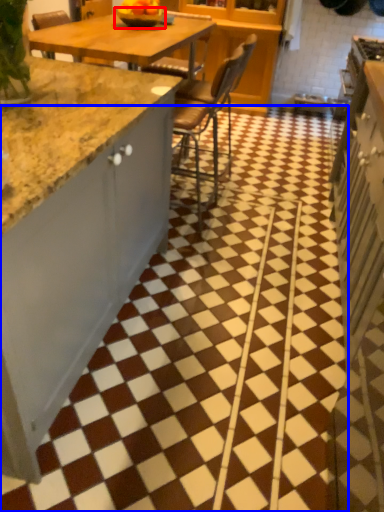
Question: Which object appears farthest to the camera in this image, bowl (highlighted by a red box) or tile (highlighted by a blue box)?

Choices:
 (A) bowl
 (B) tile

Answer: (A)